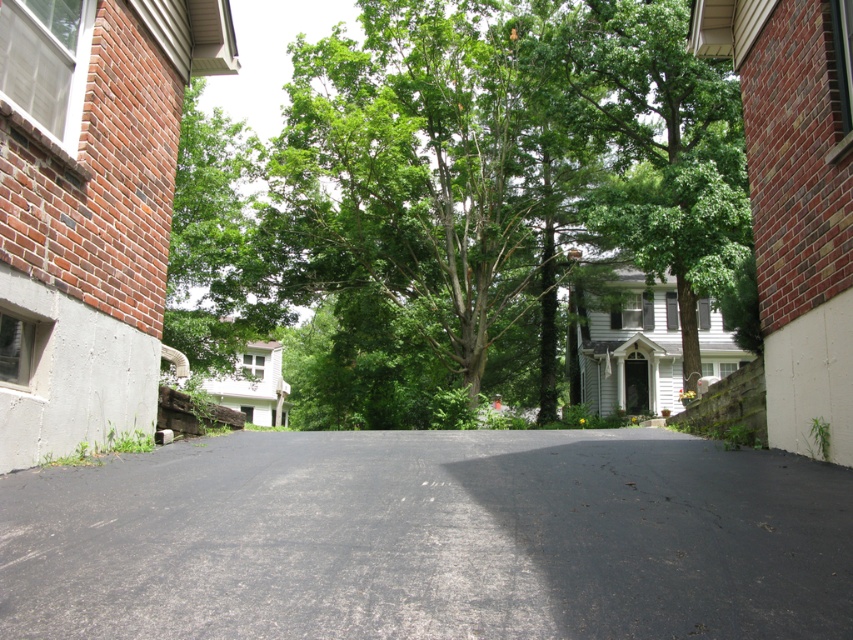
You are a gardener who wants to trim the green leafy tree at center so that it doesn not block the view of the black asphalt driveway at center. Based on the scene description, is the tree currently taller than the driveway?

The green leafy tree at center is taller than the black asphalt driveway at center, so yes, the tree is currently taller and may be blocking the view of the driveway.

You are standing on the residential street scene and want to determine which of the two points, point [547,164] or point [286,497], is closer to you. Based on the given information, which point is nearer?

Point [286,497] is closer to you because it is less further to the camera than point [547,164].